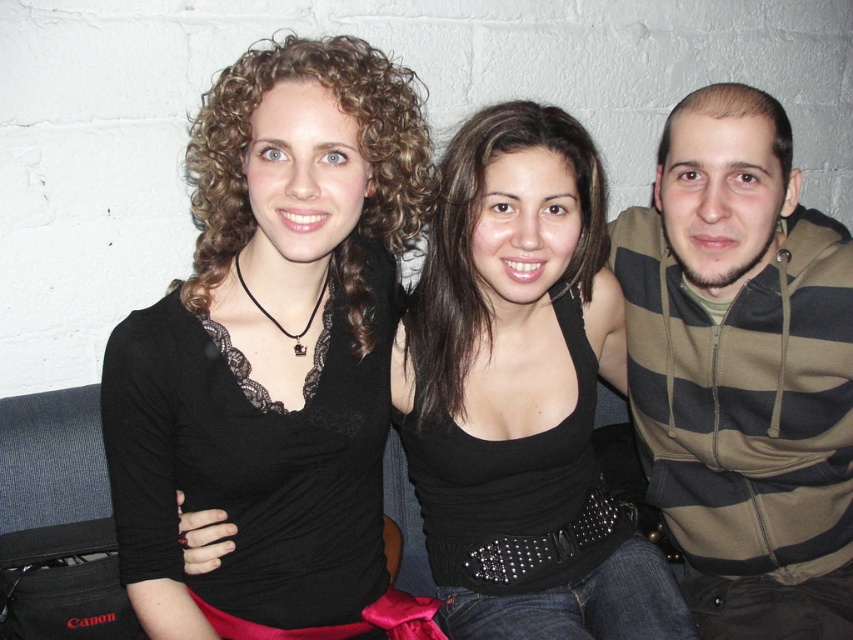
In the image, there are two people wearing the black leather tank top at center and the striped hoodie at right. Which one is positioned more to the left?

The black leather tank top at center is positioned to the left of the striped hoodie at right.

You are standing in front of the scene and want to hand a gift to the person wearing the black lace top at center without disturbing the person at the right wearing the striped hoodie at right. Which direction should you approach from?

You should approach from the side closer to the black lace top at center since it is closer to the viewer than the striped hoodie at right, allowing you to reach them without needing to go around the striped hoodie at right.